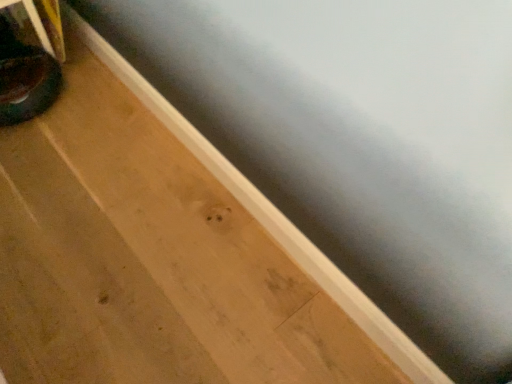
Identify the location of free space in front of shiny brown shoe at left. (36, 154).